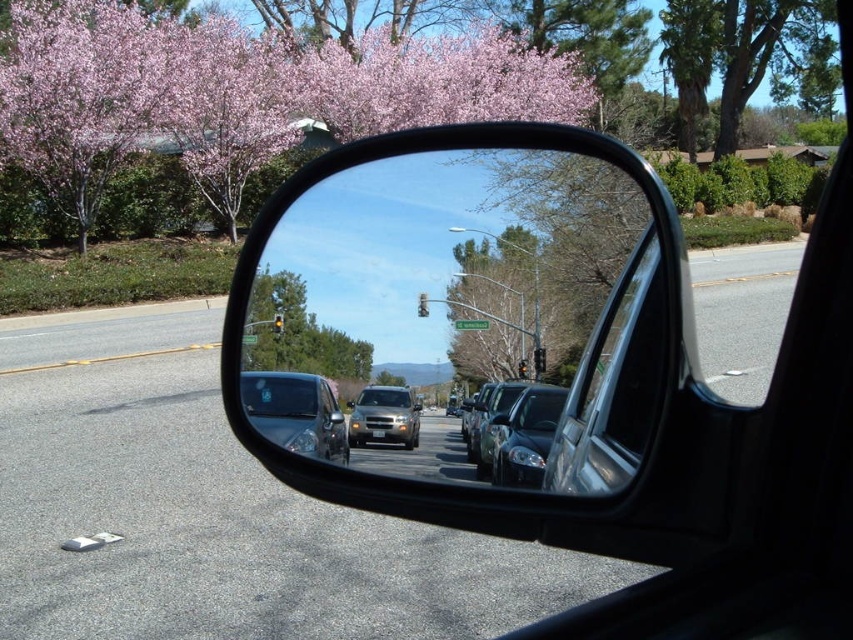
You are a driver checking your side mirror to merge into traffic. You notice a point marked at coordinates (297, 333) in the mirror. Based on the scene, what object does this point correspond to?

The point at coordinates (297, 333) corresponds to the green leafy tree at center.

You are a photographer standing 4 feet away from the glossy metallic mirror at center. You want to capture a clear reflection of the street view in the mirror. Is your current distance sufficient to ensure the reflection is sharp and clear?

The glossy metallic mirror at center and camera are 4.17 feet apart. Since you are standing 4 feet away, which is slightly closer than the optimal distance of 4.17 feet, the reflection may not be perfectly sharp. To ensure clarity, move back approximately 2 inches to match the recommended distance.

You are a passenger in the car and looking at the side mirror reflection. There are two points marked in the mirror at coordinates point (329,369) and point (343,435). Which point is closer to you?

Point (329,369) is further to the viewer than point (343,435), so the point closer to you is point (343,435).